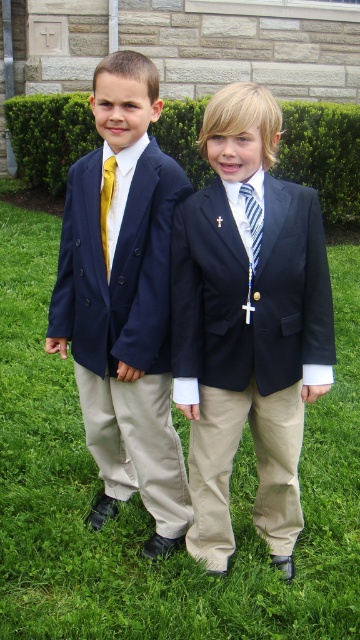
Who is positioned more to the left, green grass at center or matte black blazer at left?

From the viewer's perspective, green grass at center appears more on the left side.

Does green grass at center appear on the left side of matte black blazer at left?

Yes, green grass at center is to the left of matte black blazer at left.

The height and width of the screenshot is (640, 360). Describe the element at coordinates (141, 500) in the screenshot. I see `green grass at center` at that location.

The image size is (360, 640). Identify the location of green grass at center. (141, 500).

Does matte black blazer at left have a greater width compared to striped fabric tie at center?

Yes.

Looking at this image, who is more forward, [138,276] or [253,266]?

Point [253,266] is in front.

The height and width of the screenshot is (640, 360). I want to click on matte black blazer at left, so click(123, 301).

Does matte black suit at center lie behind gold silk tie at left?

No, it is not.

Is point (273, 472) positioned in front of point (110, 180)?

No, it is not.

In order to click on matte black suit at center in this screenshot , I will do `click(248, 326)`.